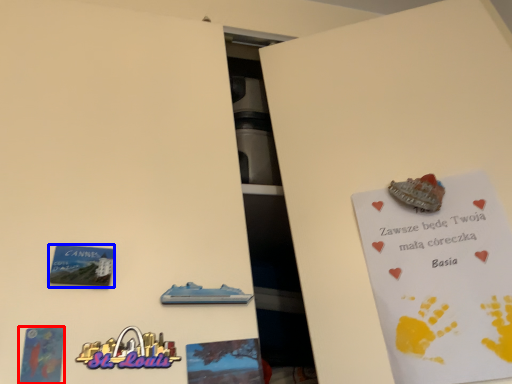
Question: Which object appears closest to the camera in this image, postcard (highlighted by a red box) or plaque (highlighted by a blue box)?

Choices:
 (A) postcard
 (B) plaque

Answer: (A)